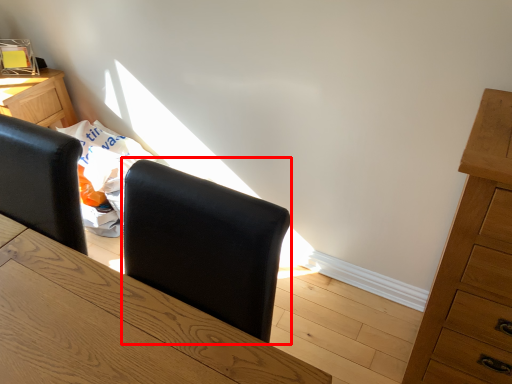
Question: From the image, what is the correct spatial relationship of armchair (annotated by the red box) in relation to chest of drawers?

Choices:
 (A) right
 (B) left

Answer: (B)